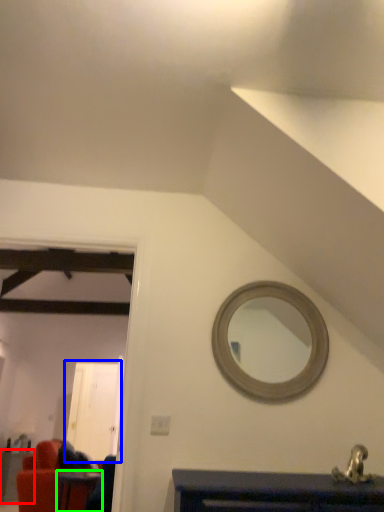
Question: Which object is the farthest from table (highlighted by a red box)? Choose among these: glass door (highlighted by a blue box) or table (highlighted by a green box).

Choices:
 (A) glass door
 (B) table

Answer: (A)